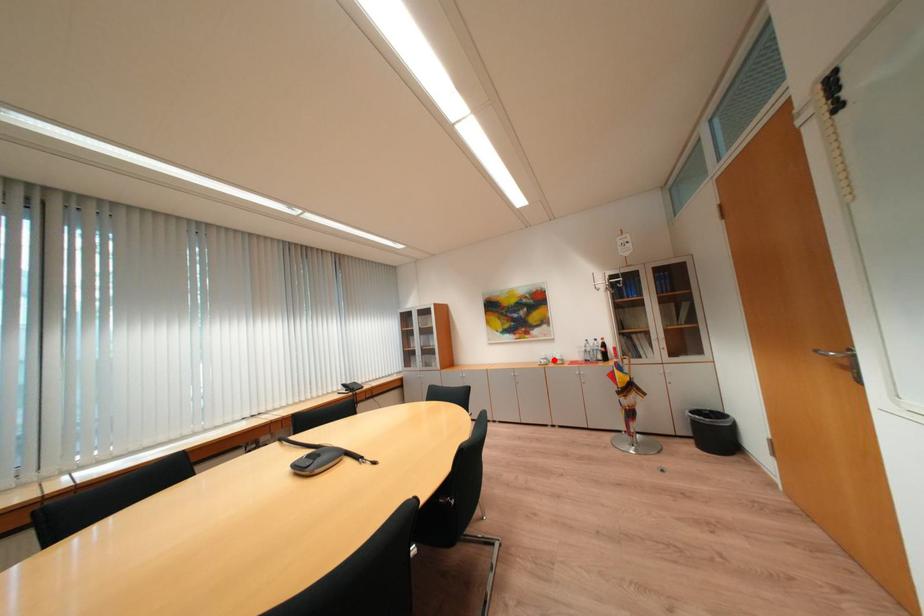
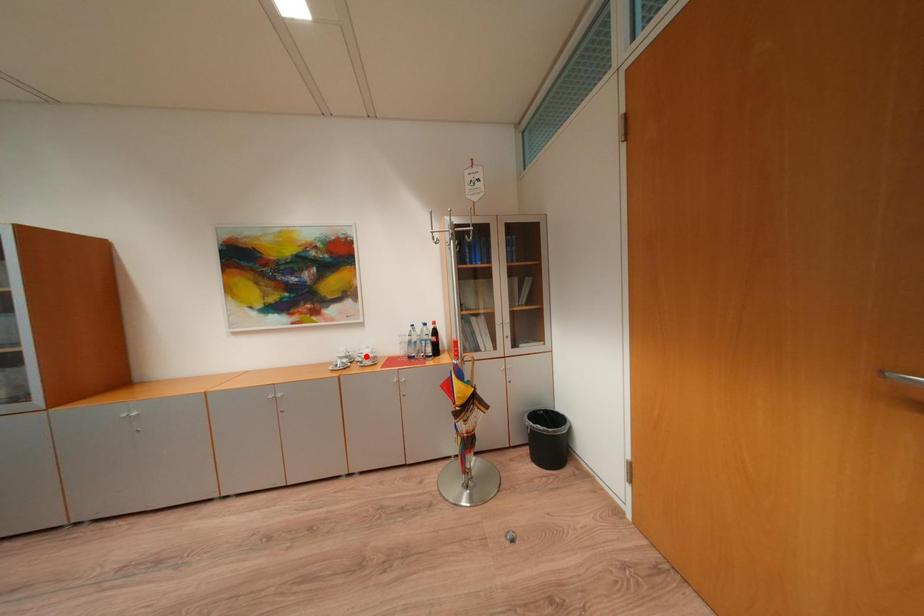
I am providing you with two images of the same scene from different viewpoints. A red point is marked on the first image and another point is marked on the second image. Is the marked point in image1 the same physical position as the marked point in image2?

No